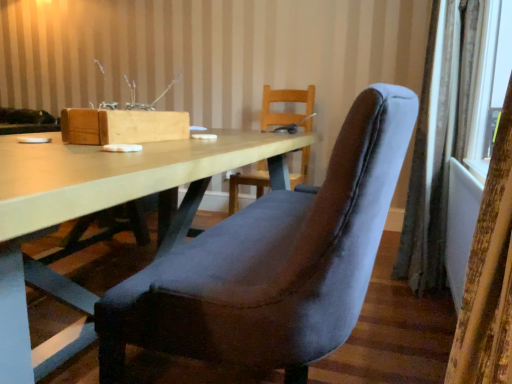
Question: Is velvet curtain at right, arranged as the 2th curtain when viewed from the right, taller than matte wood table at center?

Choices:
 (A) no
 (B) yes

Answer: (B)

Question: Is velvet curtain at right, acting as the first curtain starting from the left, far away from matte wood table at center?

Choices:
 (A) no
 (B) yes

Answer: (A)

Question: Considering the relative sizes of velvet curtain at right, acting as the first curtain starting from the left, and matte wood table at center in the image provided, is velvet curtain at right, acting as the first curtain starting from the left, bigger than matte wood table at center?

Choices:
 (A) yes
 (B) no

Answer: (B)

Question: Does velvet curtain at right, arranged as the 2th curtain when viewed from the right, turn towards matte wood table at center?

Choices:
 (A) no
 (B) yes

Answer: (B)

Question: Is velvet curtain at right, which is the second curtain in back-to-front order, thinner than matte wood table at center?

Choices:
 (A) yes
 (B) no

Answer: (A)

Question: Is velvet curtain at right, the 2th curtain from the front, bigger or smaller than velvet curtain at right, arranged as the 2th curtain when viewed from the right?

Choices:
 (A) small
 (B) big

Answer: (B)

Question: Would you say velvet curtain at right, the second curtain positioned from the left, is to the left or to the right of velvet curtain at right, arranged as the 2th curtain when viewed from the right, in the picture?

Choices:
 (A) right
 (B) left

Answer: (A)

Question: From their relative heights in the image, would you say velvet curtain at right, the first curtain positioned from the right, is taller or shorter than velvet curtain at right, which is the second curtain in back-to-front order?

Choices:
 (A) short
 (B) tall

Answer: (B)

Question: Is velvet curtain at right, the 2th curtain from the front, in front of or behind velvet curtain at right, acting as the first curtain starting from the left, in the image?

Choices:
 (A) front
 (B) behind

Answer: (B)

Question: Is velvet curtain at right, the first curtain positioned from the right, in front of or behind matte wood table at center in the image?

Choices:
 (A) behind
 (B) front

Answer: (A)

Question: From the image's perspective, is velvet curtain at right, the first curtain in the back-to-front sequence, above or below matte wood table at center?

Choices:
 (A) below
 (B) above

Answer: (B)

Question: Considering the positions of velvet curtain at right, the 2th curtain from the front, and matte wood table at center in the image, is velvet curtain at right, the 2th curtain from the front, bigger or smaller than matte wood table at center?

Choices:
 (A) big
 (B) small

Answer: (B)

Question: Is velvet curtain at right, the first curtain positioned from the right, taller or shorter than matte wood table at center?

Choices:
 (A) tall
 (B) short

Answer: (A)

Question: Does point (10, 276) appear closer or farther from the camera than point (422, 196)?

Choices:
 (A) closer
 (B) farther

Answer: (A)

Question: From a real-world perspective, is matte wood table at center positioned above or below velvet curtain at right, the 2th curtain from the front?

Choices:
 (A) below
 (B) above

Answer: (A)